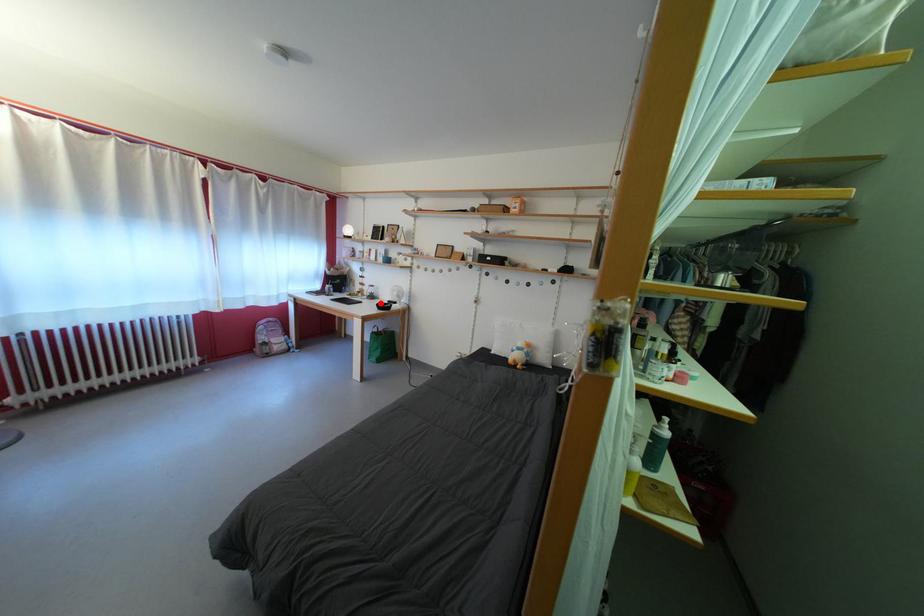
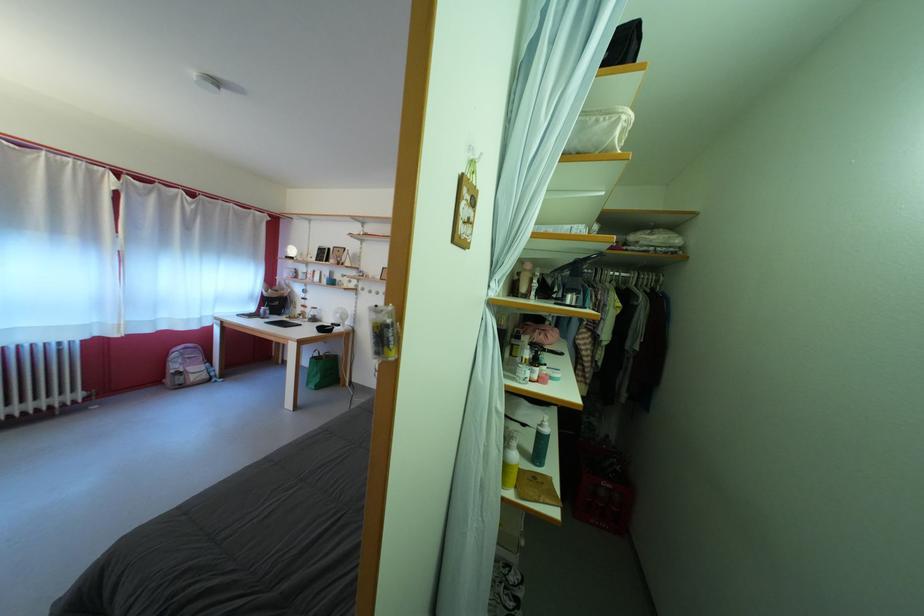
Find the pixel in the second image that matches the highlighted location in the first image.

(322, 325)